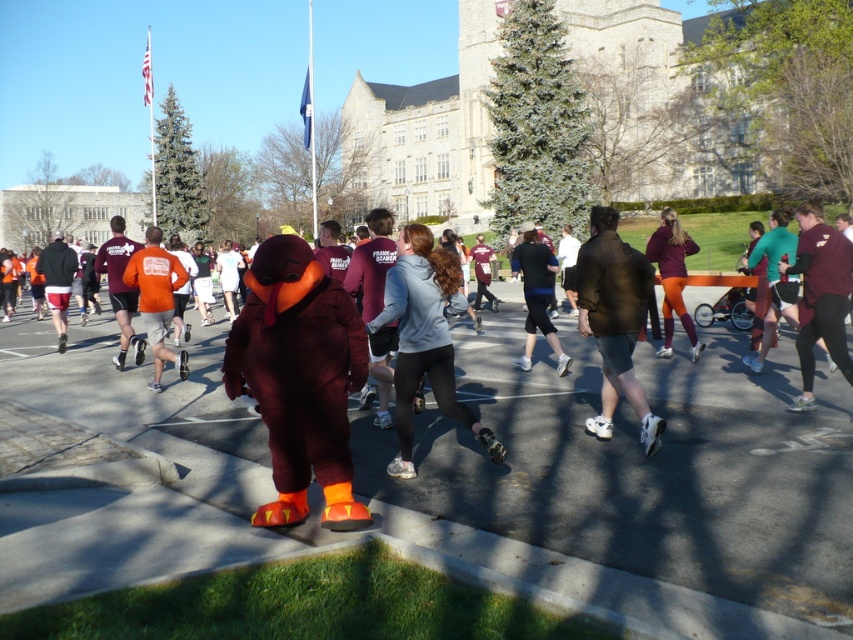
You are a photographer at the event and want to capture a photo where both the maroon jersey at right and the orange fabric turkey at center are clearly visible. Based on their sizes, which object should you focus on first to ensure it is in frame?

The orange fabric turkey at center is taller than the maroon jersey at right, so you should focus on the orange fabric turkey at center first to ensure it fits within the frame.

In the scene shown: You are a photographer positioned at the starting line of the Turkey Trot race. You want to capture a photo that includes both the gray matte hoodie at center and the maroon fabric pants at center. Based on their positions, which object should you adjust your camera angle to focus on first to ensure both are in frame?

Since the gray matte hoodie at center is to the left of the maroon fabric pants at center, you should first focus on the gray matte hoodie at center to ensure it stays within the frame while adjusting for the maroon fabric pants at center.

You are a photographer positioned at the center of the image. You want to take a photo of the maroon jersey at right. Based on its position, where should you aim your camera? Please provide the coordinates as a point in the format of a tuple with two decimal numbers between 0 and 1, where 0 is the bottom left corner and 1 is the top right corner of the image.

The maroon jersey at right is located at point coordinates of 0.463 and 0.962, so you should aim your camera at the point coordinates of approximately 0.463 and 0.962 to capture the maroon jersey at right in the image.